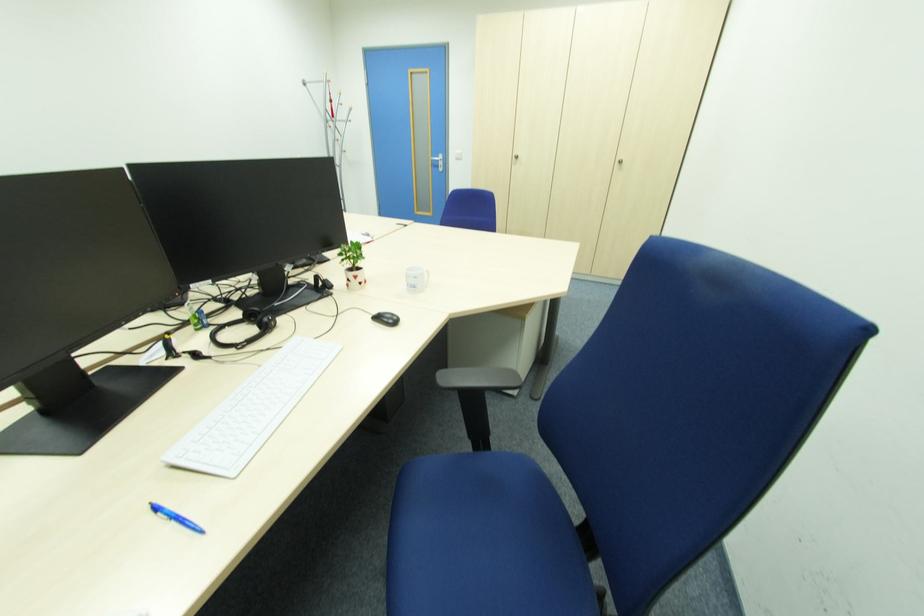
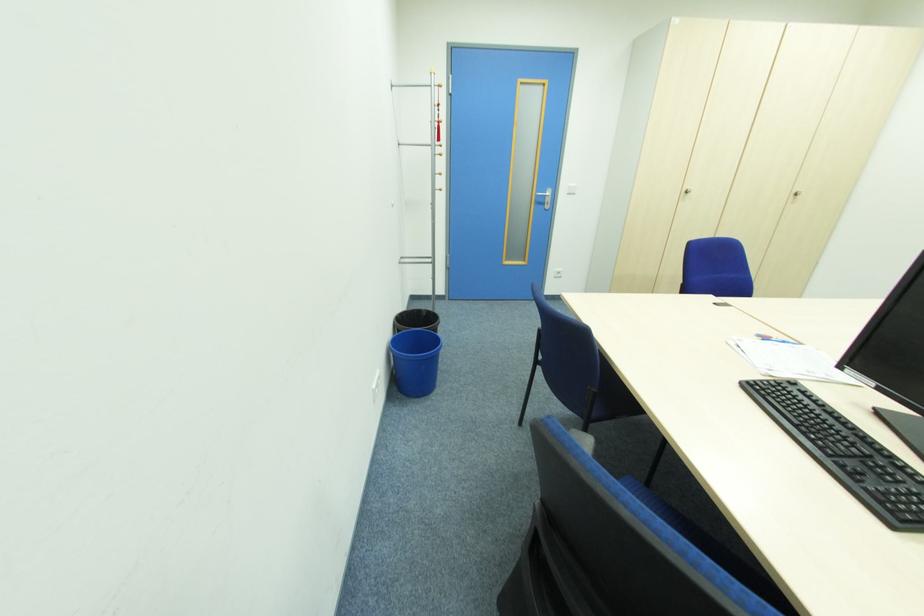
What movement of the cameraman would produce the second image?

The movement direction of the cameraman is left, forward.